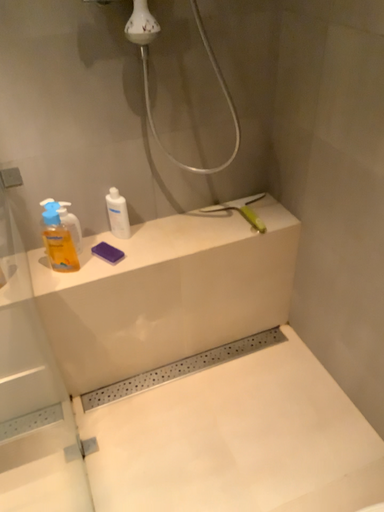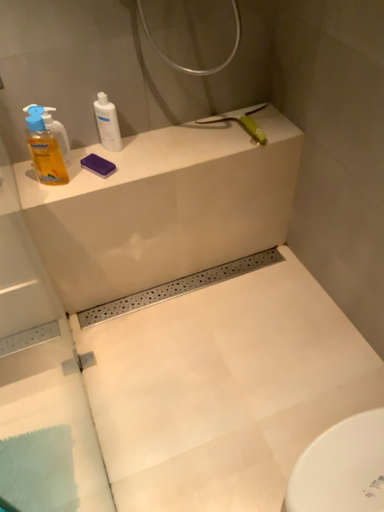
Question: How did the camera likely rotate when shooting the video?

Choices:
 (A) rotated upward
 (B) rotated downward

Answer: (B)